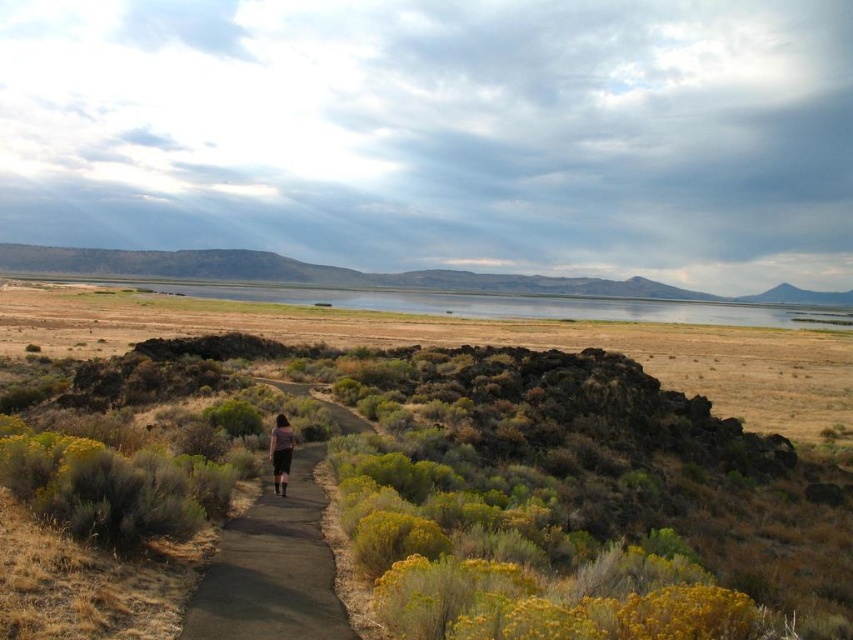
Who is lower down, green shrubs at center or black asphalt path at center?

black asphalt path at center is below.

Describe the element at coordinates (469, 470) in the screenshot. The image size is (853, 640). I see `green shrubs at center` at that location.

Find the location of `green shrubs at center`. green shrubs at center is located at coordinates (469, 470).

Does green shrubs at center appear on the right side of dark gray fabric skirt at center?

In fact, green shrubs at center is to the left of dark gray fabric skirt at center.

Can you confirm if green shrubs at center is wider than dark gray fabric skirt at center?

Indeed, green shrubs at center has a greater width compared to dark gray fabric skirt at center.

Is point (578, 532) less distant than point (281, 481)?

Yes, point (578, 532) is in front of point (281, 481).

The image size is (853, 640). I want to click on green shrubs at center, so click(x=469, y=470).

In the scene shown: Does black asphalt path at center have a lesser height compared to dark gray fabric skirt at center?

No, black asphalt path at center is not shorter than dark gray fabric skirt at center.

What do you see at coordinates (271, 570) in the screenshot? I see `black asphalt path at center` at bounding box center [271, 570].

Identify the location of black asphalt path at center. The height and width of the screenshot is (640, 853). (271, 570).